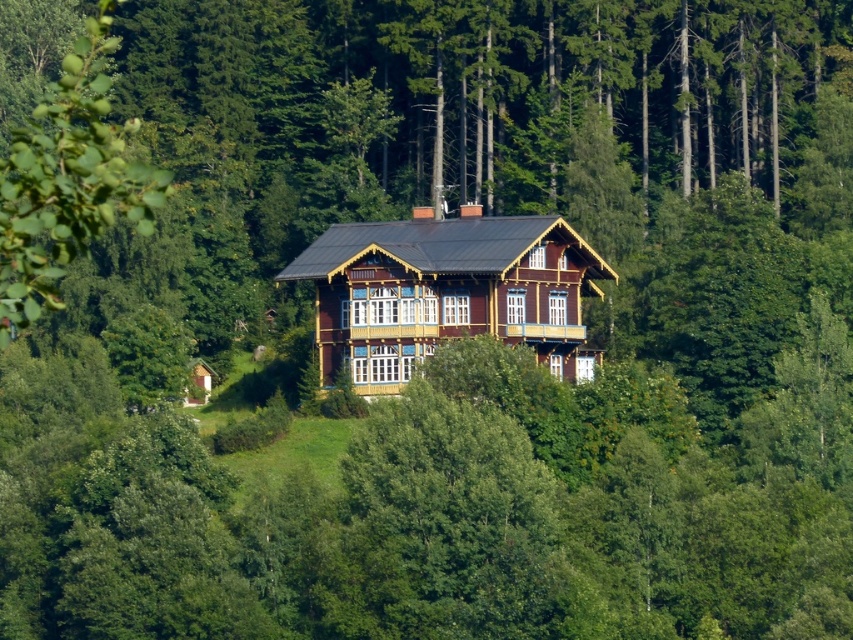
You are standing at point 0.5, 0.5 in the image. You want to go to the wooden cabin at center. Which direction should you move in?

Since the wooden cabin at center is located at point (445, 291) and you are at point (426, 320), you should move slightly to the left and down to reach it.

You are standing in front of the wooden cabin at center and want to get a clear view of the green leafy tree at left. Since the tree is partially hidden, can you determine if you need to move forward or backward to see more of it?

The green leafy tree at left is behind the wooden cabin at center, so moving forward would bring you closer to the cabin and potentially block more of the tree. To see more of the green leafy tree at left, you should move backward to create more distance between yourself and the wooden cabin at center, allowing the tree to become more visible.

Based on the photo, you are standing at the point marked as point (445, 291) in the image. What is the nearest object to you?

The point (445, 291) indicates the wooden cabin at center, so the nearest object to you is the wooden cabin at center.